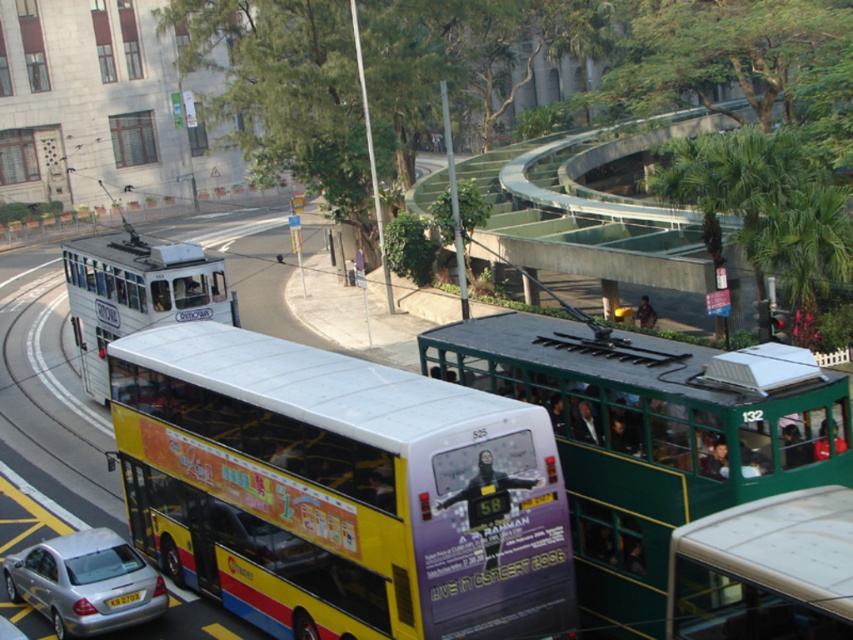
From the picture: Who is shorter, green metallic tram at center or silver metallic car at lower left?

green metallic tram at center is shorter.

Can you confirm if green metallic tram at center is thinner than silver metallic car at lower left?

Yes, green metallic tram at center is thinner than silver metallic car at lower left.

At what (x,y) coordinates should I click in order to perform the action: click on green metallic tram at center. Please return your answer as a coordinate pair (x, y). Looking at the image, I should click on (651, 438).

Which is in front, point (94, 253) or point (91, 579)?

Positioned in front is point (91, 579).

Is white matte trolleybus at left thinner than silver metallic car at lower left?

No.

The width and height of the screenshot is (853, 640). Find the location of `white matte trolleybus at left`. white matte trolleybus at left is located at coordinates (136, 292).

Which of these two, yellow painted decker bus at center or black plastic license plate at lower center, stands taller?

Standing taller between the two is yellow painted decker bus at center.

Can you confirm if yellow painted decker bus at center is positioned to the left of black plastic license plate at lower center?

In fact, yellow painted decker bus at center is to the right of black plastic license plate at lower center.

The height and width of the screenshot is (640, 853). Describe the element at coordinates (339, 490) in the screenshot. I see `yellow painted decker bus at center` at that location.

Where is `yellow painted decker bus at center`? This screenshot has width=853, height=640. yellow painted decker bus at center is located at coordinates (339, 490).